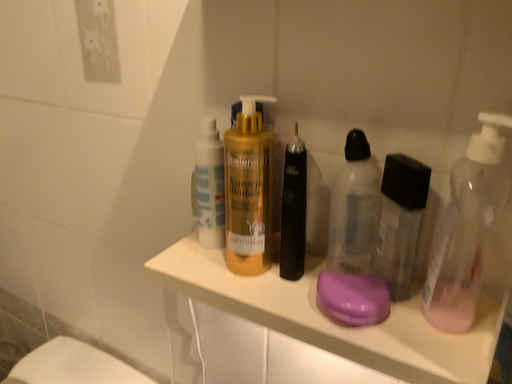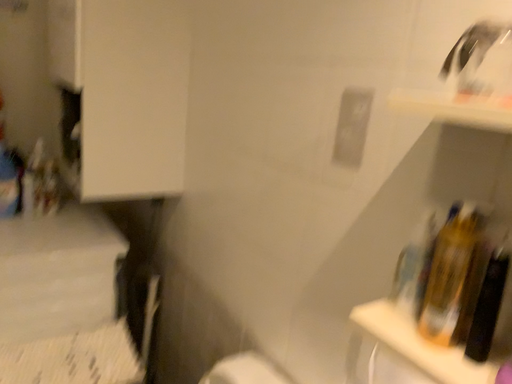
Question: Which way did the camera rotate in the video?

Choices:
 (A) rotated upward
 (B) rotated downward

Answer: (A)